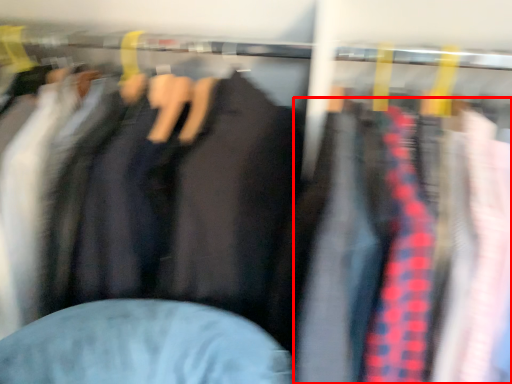
Question: From the image, what is the correct spatial relationship of clothing (annotated by the red box) in relation to jacket?

Choices:
 (A) left
 (B) right

Answer: (B)